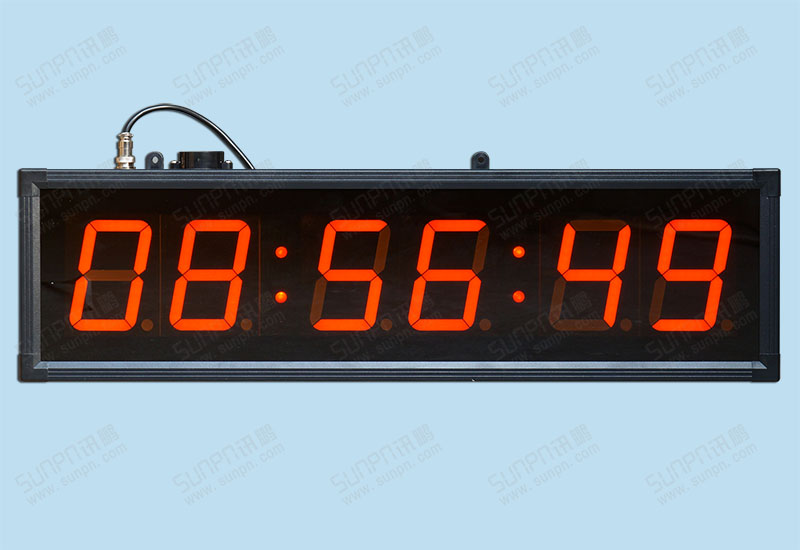
Locate an element on the screen. This screenshot has height=550, width=800. clock border is located at coordinates (130, 370).